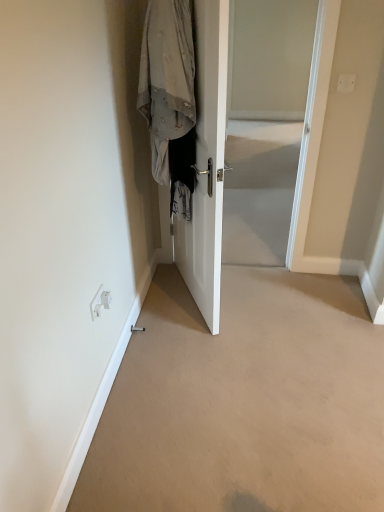
You are a GUI agent. You are given a task and a screenshot of the screen. Output one action in this format:
    pyautogui.click(x=<x>, y=<y>)
    Task: Click on the free spot to the right of white glossy door at center
    The image size is (384, 512).
    Given the screenshot: What is the action you would take?
    pyautogui.click(x=271, y=296)